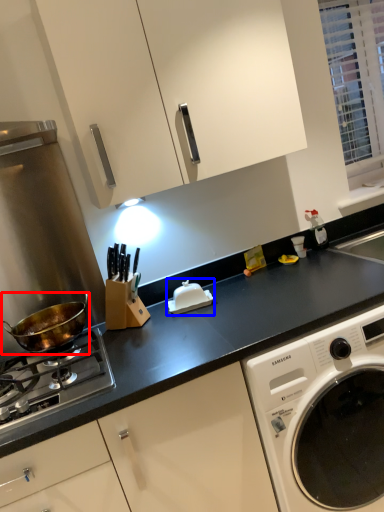
Question: Which object is further to the camera taking this photo, wok (highlighted by a red box) or appliance (highlighted by a blue box)?

Choices:
 (A) wok
 (B) appliance

Answer: (B)